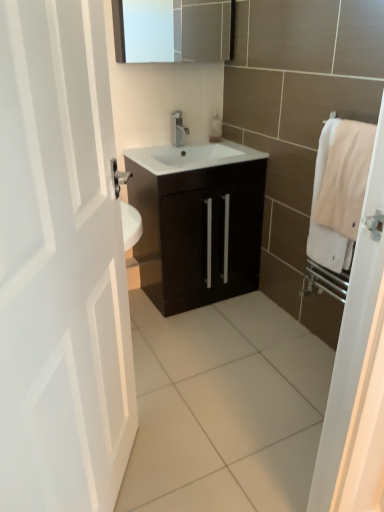
The width and height of the screenshot is (384, 512). Find the location of `free point to the right of satin nickel faucet at center`. free point to the right of satin nickel faucet at center is located at coordinates (206, 146).